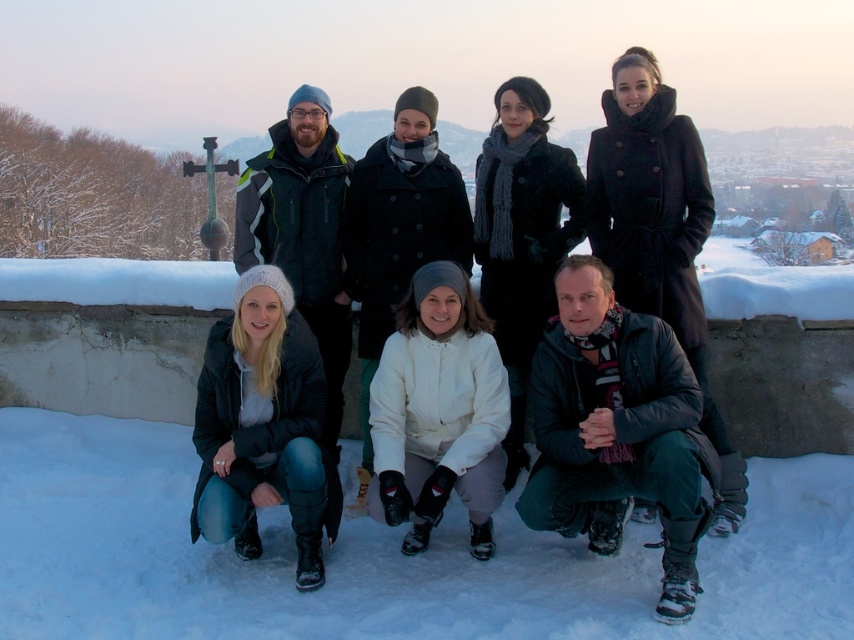
You are standing at the origin of a coordinate system placed at the bottom left corner of the image. You see a point at coordinates (621, 348). What object is located at that point?

The point at coordinates (621, 348) corresponds to the matte black coat at center.

You are a photographer trying to capture the group photo. You need to ensure that the white fluffy snow at lower center and the matte black coat at center are both visible in the frame. Which object is closer to the camera, and why?

The white fluffy snow at lower center is closer to the camera because it is positioned below the matte black coat at center, meaning it is in the foreground while the coat is in the background.

You are a photographer trying to capture the group photo. You notice the white fluffy snow at lower center and the matte black jacket at lower left. Which object is larger in the image?

The matte black jacket at lower left is larger than the white fluffy snow at lower center.